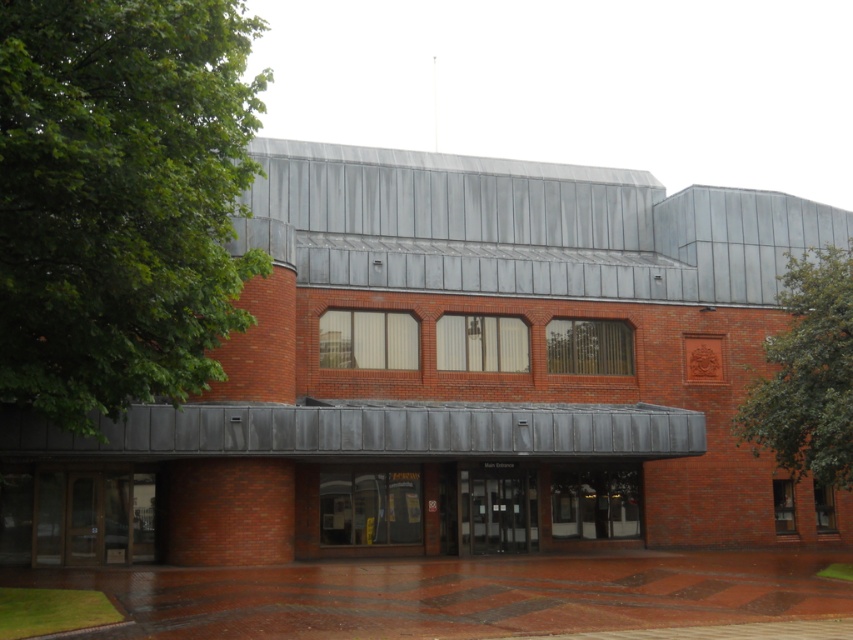
Is transparent glass door at center taller than black glass doors at center?

Incorrect, transparent glass door at center's height is not larger of black glass doors at center's.

Identify the location of transparent glass door at center. (370, 506).

Where is `transparent glass door at center`? The image size is (853, 640). transparent glass door at center is located at coordinates (370, 506).

Does green leafy tree at upper right appear over matte glass doors at center?

Correct, green leafy tree at upper right is located above matte glass doors at center.

Can you confirm if green leafy tree at upper right is thinner than matte glass doors at center?

Yes, green leafy tree at upper right is thinner than matte glass doors at center.

Between point (846, 250) and point (612, 476), which one is positioned behind?

The point (846, 250) is more distant.

What are the coordinates of `green leafy tree at upper right` in the screenshot? It's located at (807, 372).

Does green leafy tree at left appear over green leafy tree at upper right?

Incorrect, green leafy tree at left is not positioned above green leafy tree at upper right.

Who is more distant from viewer, (258, 170) or (815, 468)?

Positioned behind is point (815, 468).

This screenshot has height=640, width=853. Identify the location of green leafy tree at left. (120, 198).